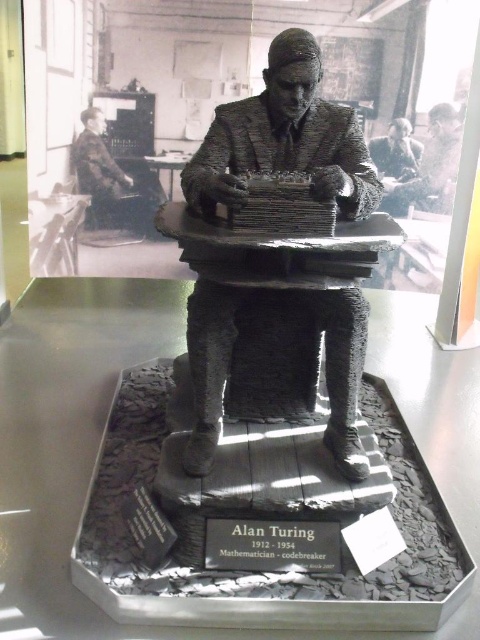
Question: Estimate the real-world distances between objects in this image. Which object is farther from the bronze textured statue at center?

Choices:
 (A) camouflage fabric jacket at upper left
 (B) black stone plaque at center

Answer: (A)

Question: Which of the following is the closest to the observer?

Choices:
 (A) (84, 157)
 (B) (322, 65)

Answer: (B)

Question: Which is nearer to the bronze textured statue at center?

Choices:
 (A) black stone plaque at center
 (B) camouflage fabric jacket at upper left

Answer: (A)

Question: Can you confirm if black stone plaque at center is positioned to the right of camouflage fabric jacket at upper left?

Choices:
 (A) no
 (B) yes

Answer: (B)

Question: Is black stone plaque at center to the right of camouflage fabric jacket at upper left from the viewer's perspective?

Choices:
 (A) yes
 (B) no

Answer: (A)

Question: Does black stone plaque at center appear under camouflage fabric jacket at upper left?

Choices:
 (A) no
 (B) yes

Answer: (B)